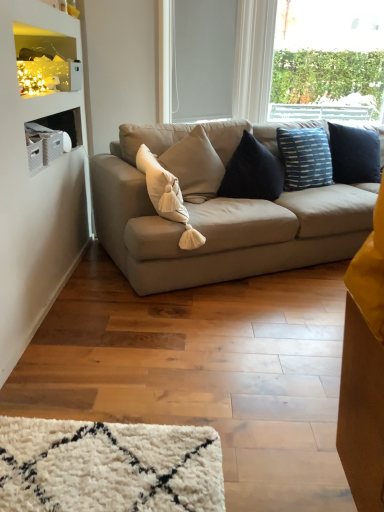
Measure the distance between point (210,72) and camera.

Point (210,72) and camera are 3.43 meters apart.

At what (x,y) coordinates should I click in order to perform the action: click on white matte window screen at upper center. Please return your answer as a coordinate pair (x, y). Looking at the image, I should click on (202, 58).

At what (x,y) coordinates should I click in order to perform the action: click on suede beige couch at center. Please return your answer as a coordinate pair (x, y). Looking at the image, I should click on (218, 223).

This screenshot has height=512, width=384. Describe the element at coordinates (45, 61) in the screenshot. I see `matte white shelf at upper left` at that location.

Based on the photo, measure the distance between matte white shelf at upper left and camera.

A distance of 6.83 feet exists between matte white shelf at upper left and camera.

Where is `beige fabric pillow at center`? The width and height of the screenshot is (384, 512). beige fabric pillow at center is located at coordinates (167, 196).

Considering the positions of objects transparent glass window at upper right and matte white shelf at upper left in the image provided, who is more to the right, transparent glass window at upper right or matte white shelf at upper left?

Positioned to the right is transparent glass window at upper right.

In terms of width, does transparent glass window at upper right look wider or thinner when compared to matte white shelf at upper left?

Clearly, transparent glass window at upper right has less width compared to matte white shelf at upper left.

From the image's perspective, is transparent glass window at upper right above matte white shelf at upper left?

Correct, transparent glass window at upper right appears higher than matte white shelf at upper left in the image.

Looking at this image, can you confirm if transparent glass window at upper right is taller than matte white shelf at upper left?

Correct, transparent glass window at upper right is much taller as matte white shelf at upper left.

Is suede beige couch at center located within white matte window screen at upper center?

No.

Measure the distance from white matte window screen at upper center to suede beige couch at center.

The distance of white matte window screen at upper center from suede beige couch at center is 1.05 meters.

Is white matte window screen at upper center touching suede beige couch at center?

No.

In the scene shown: From a real-world perspective, relative to suede beige couch at center, is white matte window screen at upper center vertically above or below?

white matte window screen at upper center is above suede beige couch at center.

From the picture: Is there a large distance between suede beige couch at center and white matte window screen at upper center?

Yes.

Image resolution: width=384 pixels, height=512 pixels. I want to click on studio couch in front of the white matte window screen at upper center, so click(x=218, y=223).

Is suede beige couch at center bigger or smaller than white matte window screen at upper center?

Clearly, suede beige couch at center is larger in size than white matte window screen at upper center.

Could white matte window screen at upper center be considered to be inside suede beige couch at center?

No, suede beige couch at center does not contain white matte window screen at upper center.

Is point (336, 36) closer or farther from the camera than point (232, 257)?

Point (336, 36) appears to be farther away from the viewer than point (232, 257).

Between transparent glass window at upper right and suede beige couch at center, which one has larger size?

Bigger between the two is suede beige couch at center.

Which is in front, transparent glass window at upper right or suede beige couch at center?

suede beige couch at center.

Locate an element on the screen. window lying above the suede beige couch at center (from the image's perspective) is located at coordinates (329, 53).

From a real-world perspective, who is located higher, suede beige couch at center or transparent glass window at upper right?

transparent glass window at upper right.

Does point (332, 231) appear closer or farther from the camera than point (326, 15)?

Clearly, point (332, 231) is closer to the camera than point (326, 15).

Considering the relative positions of suede beige couch at center and transparent glass window at upper right in the image provided, is suede beige couch at center to the left or to the right of transparent glass window at upper right?

Based on their positions, suede beige couch at center is located to the left of transparent glass window at upper right.

From the image's perspective, which one is positioned higher, beige fabric pillow at center or matte white shelf at upper left?

matte white shelf at upper left.

Is beige fabric pillow at center positioned far away from matte white shelf at upper left?

beige fabric pillow at center is near matte white shelf at upper left, not far away.

Find the location of a particular element. shelf lying above the beige fabric pillow at center (from the image's perspective) is located at coordinates (45, 61).

Is white matte window screen at upper center inside the boundaries of beige fabric pillow at center, or outside?

white matte window screen at upper center is not enclosed by beige fabric pillow at center.

Find the location of a particular element. This screenshot has height=512, width=384. pillow in front of the white matte window screen at upper center is located at coordinates (167, 196).

In the image, is white matte window screen at upper center on the left side or the right side of beige fabric pillow at center?

From the image, it's evident that white matte window screen at upper center is to the right of beige fabric pillow at center.

From a real-world perspective, between white matte window screen at upper center and beige fabric pillow at center, who is vertically lower?

beige fabric pillow at center is physically lower.

Locate an element on the screen. This screenshot has height=512, width=384. shelf on the left of the transparent glass window at upper right is located at coordinates (45, 61).

Locate an element on the screen. studio couch in front of the white matte window screen at upper center is located at coordinates (218, 223).

Based on their spatial positions, is matte white shelf at upper left or white matte window screen at upper center further from suede beige couch at center?

Among the two, white matte window screen at upper center is located further to suede beige couch at center.

Which object lies further to the anchor point white matte window screen at upper center, transparent glass window at upper right or beige fabric pillow at center?

The object further to white matte window screen at upper center is transparent glass window at upper right.

When comparing their distances from suede beige couch at center, does white matte window screen at upper center or transparent glass window at upper right seem closer?

white matte window screen at upper center is closer to suede beige couch at center.

Looking at the image, which one is located closer to transparent glass window at upper right, suede beige couch at center or matte white shelf at upper left?

suede beige couch at center is positioned closer to the anchor transparent glass window at upper right.

From the image, which object appears to be farther from suede beige couch at center, transparent glass window at upper right or white matte window screen at upper center?

transparent glass window at upper right.

When comparing their distances from matte white shelf at upper left, does transparent glass window at upper right or beige fabric pillow at center seem closer?

beige fabric pillow at center lies closer to matte white shelf at upper left than the other object.

Considering their positions, is transparent glass window at upper right positioned further to beige fabric pillow at center than suede beige couch at center?

Among the two, transparent glass window at upper right is located further to beige fabric pillow at center.

Estimate the real-world distances between objects in this image. Which object is further from transparent glass window at upper right, beige fabric pillow at center or matte white shelf at upper left?

→ The object further to transparent glass window at upper right is beige fabric pillow at center.

Find the location of a particular element. pillow between matte white shelf at upper left and transparent glass window at upper right in the horizontal direction is located at coordinates (167, 196).

Find the location of `pillow between matte white shelf at upper left and suede beige couch at center from left to right`. pillow between matte white shelf at upper left and suede beige couch at center from left to right is located at coordinates (167, 196).

The image size is (384, 512). What are the coordinates of `studio couch between white matte window screen at upper center and beige fabric pillow at center from top to bottom` in the screenshot? It's located at (218, 223).

Where is `pillow located between suede beige couch at center and transparent glass window at upper right in the depth direction`? The height and width of the screenshot is (512, 384). pillow located between suede beige couch at center and transparent glass window at upper right in the depth direction is located at coordinates (167, 196).